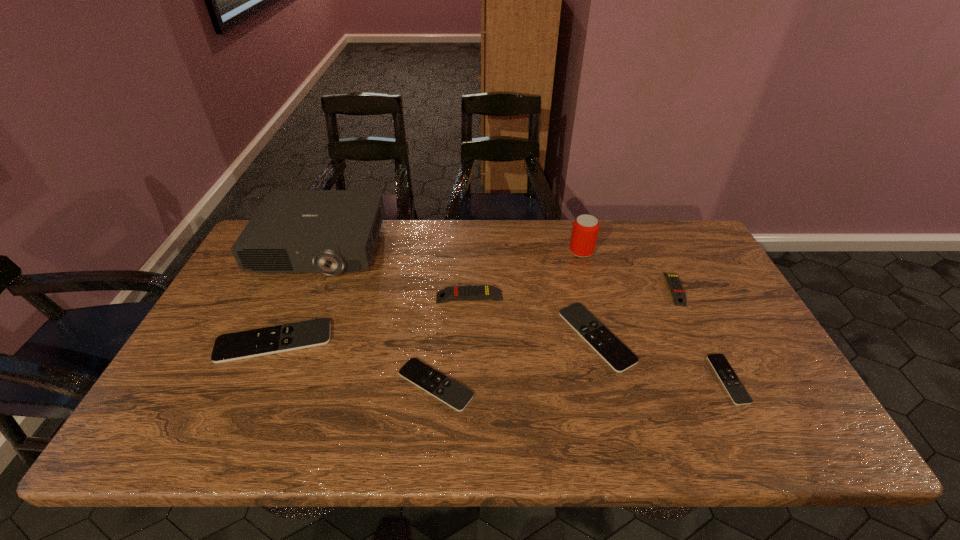
Locate an element on the screen. The height and width of the screenshot is (540, 960). vacant area that lies between the third shortest object and the second smallest black remote control is located at coordinates (516, 361).

At what (x,y) coordinates should I click in order to perform the action: click on free area in between the tallest remote control and the red beer can. Please return your answer as a coordinate pair (x, y). This screenshot has height=540, width=960. Looking at the image, I should click on (525, 274).

You are a GUI agent. You are given a task and a screenshot of the screen. Output one action in this format:
    pyautogui.click(x=<x>, y=<y>)
    Task: Click on the free point between the right yellow remote control and the leftmost black remote control
    The image size is (960, 540).
    Given the screenshot: What is the action you would take?
    pyautogui.click(x=474, y=315)

Select which object appears as the sixth closest to the third smallest black remote control. Please provide its 2D coordinates. Your answer should be formatted as a tuple, i.e. [(x, y)], where the tuple contains the x and y coordinates of a point satisfying the conditions above.

[(293, 231)]

Identify the location of object that can be found as the closest to the red beer can. The height and width of the screenshot is (540, 960). (679, 297).

Find the location of `remote control that is the fifth closest to the seventh tallest object`. remote control that is the fifth closest to the seventh tallest object is located at coordinates (679, 297).

Where is `the fourth closest remote control to the right yellow remote control`? The width and height of the screenshot is (960, 540). the fourth closest remote control to the right yellow remote control is located at coordinates (455, 395).

Where is `black remote control that can be found as the closest to the shortest object`? The width and height of the screenshot is (960, 540). black remote control that can be found as the closest to the shortest object is located at coordinates (620, 358).

Locate which black remote control is the closest to the third remote control from right to left. Please provide its 2D coordinates. Your answer should be formatted as a tuple, i.e. [(x, y)], where the tuple contains the x and y coordinates of a point satisfying the conditions above.

[(735, 389)]

Find the location of a particular element. The height and width of the screenshot is (540, 960). vacant space that satisfies the following two spatial constraints: 1. on the front-facing side of the projector; 2. on the right side of the shortest object is located at coordinates (263, 379).